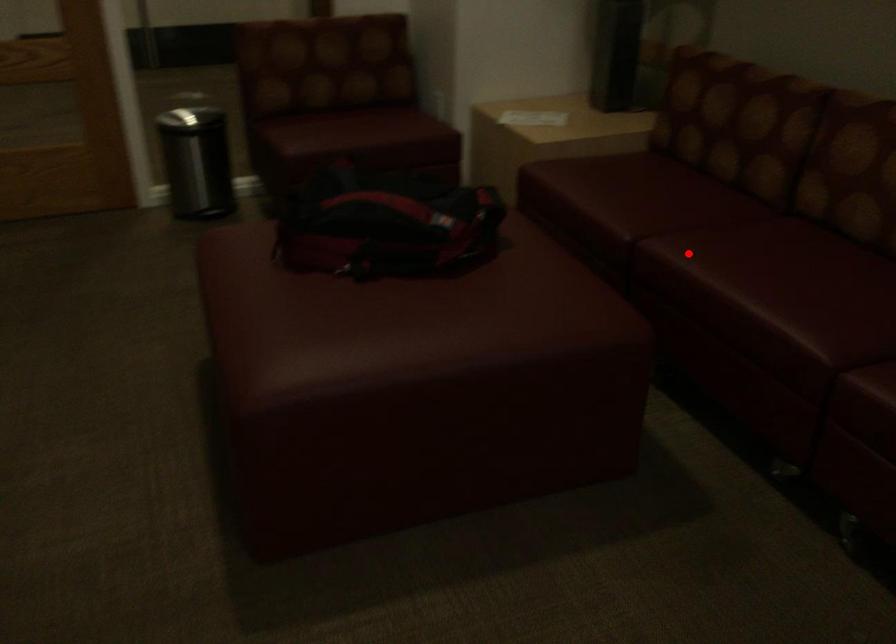
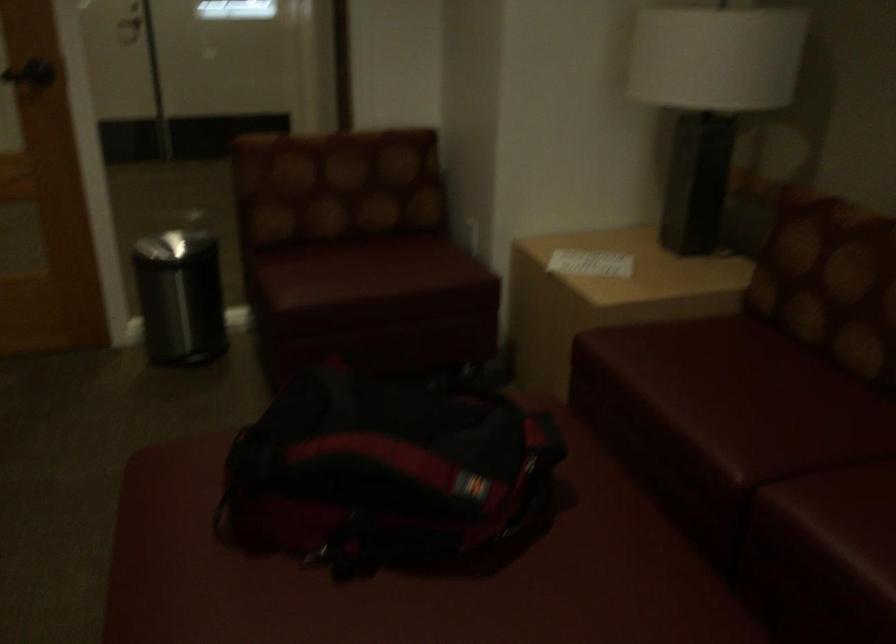
Find the pixel in the second image that matches the highlighted location in the first image.

(834, 522)